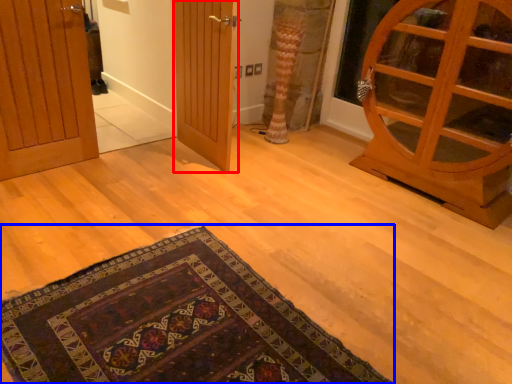
Question: Which point is closer to the camera, door (highlighted by a red box) or mat (highlighted by a blue box)?

Choices:
 (A) door
 (B) mat

Answer: (B)